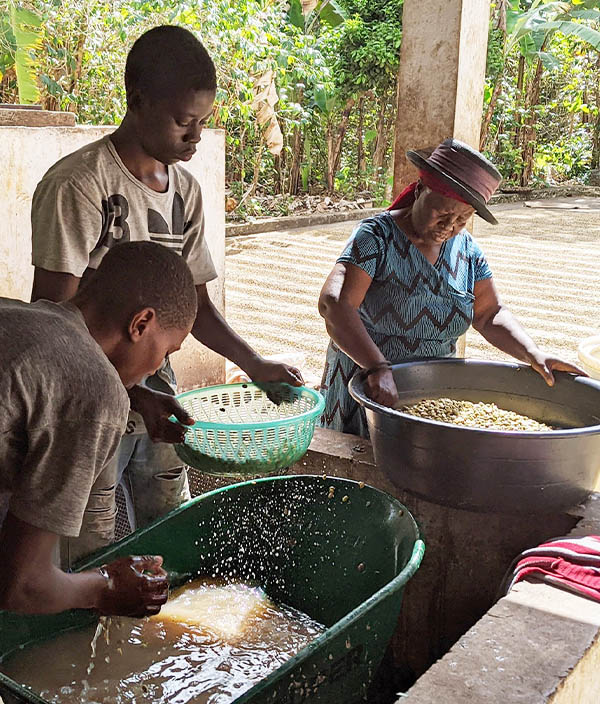
The image size is (600, 704). I want to click on pillar, so click(x=445, y=77), click(x=460, y=341), click(x=470, y=224).